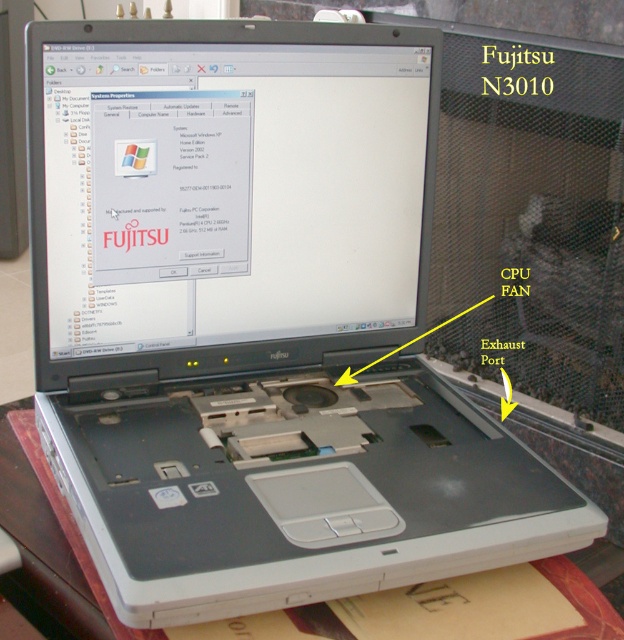
Question: Is matte black screen at center to the left of white plastic table at lower center from the viewer's perspective?

Choices:
 (A) yes
 (B) no

Answer: (B)

Question: Is matte black screen at center wider than white plastic table at lower center?

Choices:
 (A) no
 (B) yes

Answer: (A)

Question: Is matte black screen at center to the right of white plastic table at lower center from the viewer's perspective?

Choices:
 (A) yes
 (B) no

Answer: (A)

Question: Which object appears farthest from the camera in this image?

Choices:
 (A) white plastic table at lower center
 (B) matte black screen at center

Answer: (B)